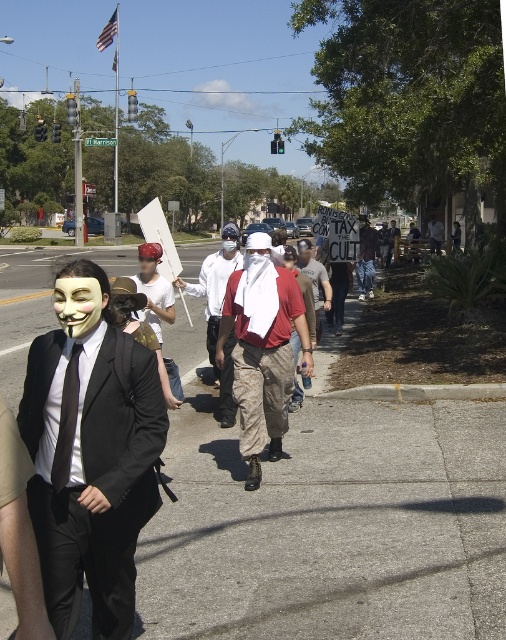
Question: Does white matte mask at center have a smaller size compared to denim pants at center?

Choices:
 (A) yes
 (B) no

Answer: (A)

Question: Which point is closer to the camera?

Choices:
 (A) (44, 476)
 (B) (149, 312)
 (C) (439, 227)
 (D) (363, 268)

Answer: (A)

Question: Does matte black suit at left appear on the left side of denim pants at center?

Choices:
 (A) yes
 (B) no

Answer: (A)

Question: Does white matte mask at left appear on the right side of white cotton shirt at center?

Choices:
 (A) yes
 (B) no

Answer: (B)

Question: Which is farther from the white cotton shirt at center?

Choices:
 (A) denim pants at center
 (B) white cloth mask at center
 (C) matte black suit at left
 (D) camouflage pants at center

Answer: (C)

Question: Which is nearer to the denim pants at center?

Choices:
 (A) white matte mask at left
 (B) camouflage pants at center
 (C) matte black suit at left

Answer: (A)